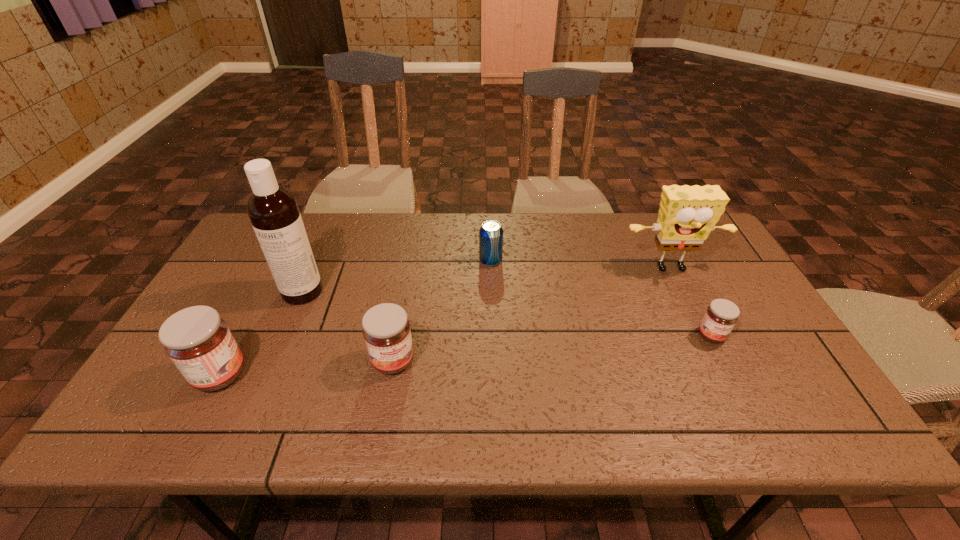
Identify the location of location for an additional jam to make spacing equal. (557, 348).